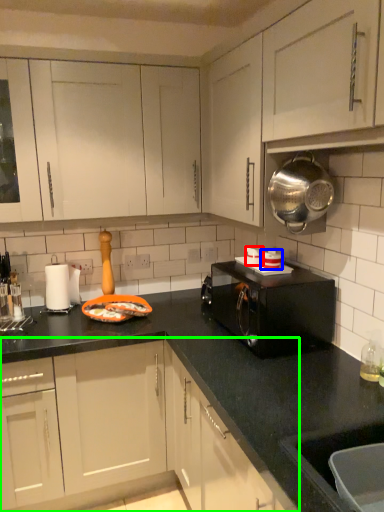
Question: Which object is positioned closest to appliance (highlighted by a red box)? Select from appliance (highlighted by a blue box) and cabinetry (highlighted by a green box).

Choices:
 (A) appliance
 (B) cabinetry

Answer: (A)